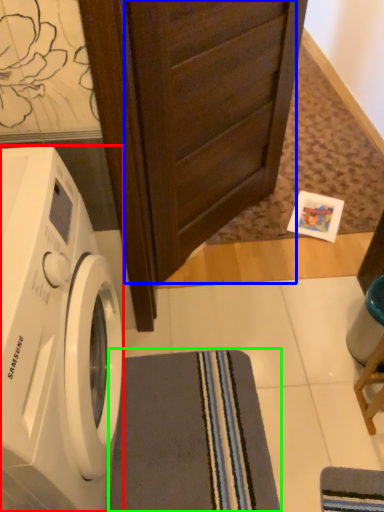
Question: Which object is positioned farthest from washing machine (highlighted by a red box)? Select from screen door (highlighted by a blue box) and bath towel (highlighted by a green box).

Choices:
 (A) screen door
 (B) bath towel

Answer: (A)